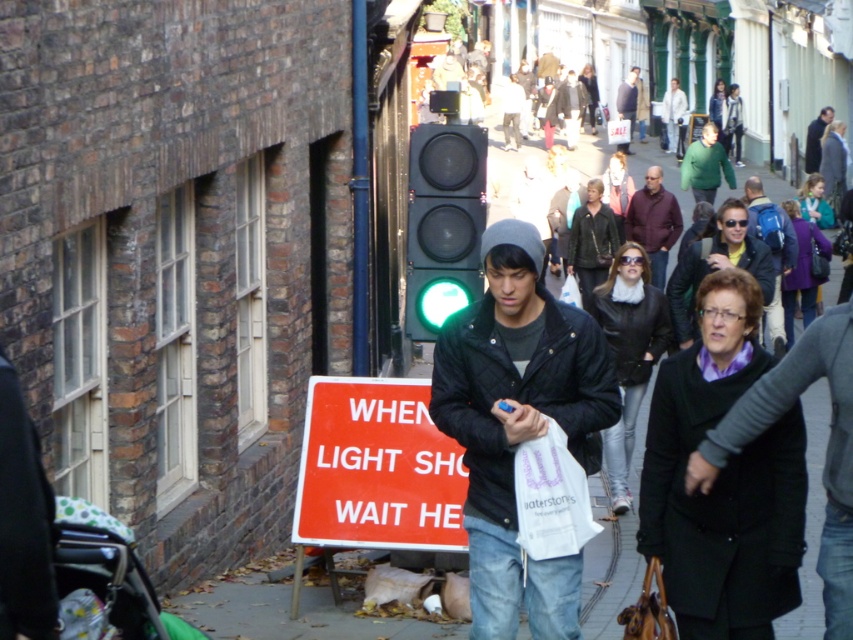
Does maroon wool sweater at center appear over dark blue jacket at center?

No, maroon wool sweater at center is not above dark blue jacket at center.

Is maroon wool sweater at center wider than dark blue jacket at center?

Yes.

Is point (627, 236) positioned behind point (645, 90)?

No, it is in front of (645, 90).

Where is `maroon wool sweater at center`? maroon wool sweater at center is located at coordinates (653, 221).

Is maroon wool sweater at center to the right of green fuzzy sweater at center from the viewer's perspective?

In fact, maroon wool sweater at center is to the left of green fuzzy sweater at center.

Can you confirm if maroon wool sweater at center is wider than green fuzzy sweater at center?

Yes, maroon wool sweater at center is wider than green fuzzy sweater at center.

In order to click on maroon wool sweater at center in this screenshot , I will do click(x=653, y=221).

Which is more to the right, green glass traffic light at center or dark blue jacket at center?

From the viewer's perspective, dark blue jacket at center appears more on the right side.

Who is shorter, green glass traffic light at center or dark blue jacket at center?

Standing shorter between the two is green glass traffic light at center.

Is point (450, 269) positioned after point (637, 93)?

No, it is not.

At what (x,y) coordinates should I click in order to perform the action: click on green glass traffic light at center. Please return your answer as a coordinate pair (x, y). This screenshot has height=640, width=853. Looking at the image, I should click on (444, 221).